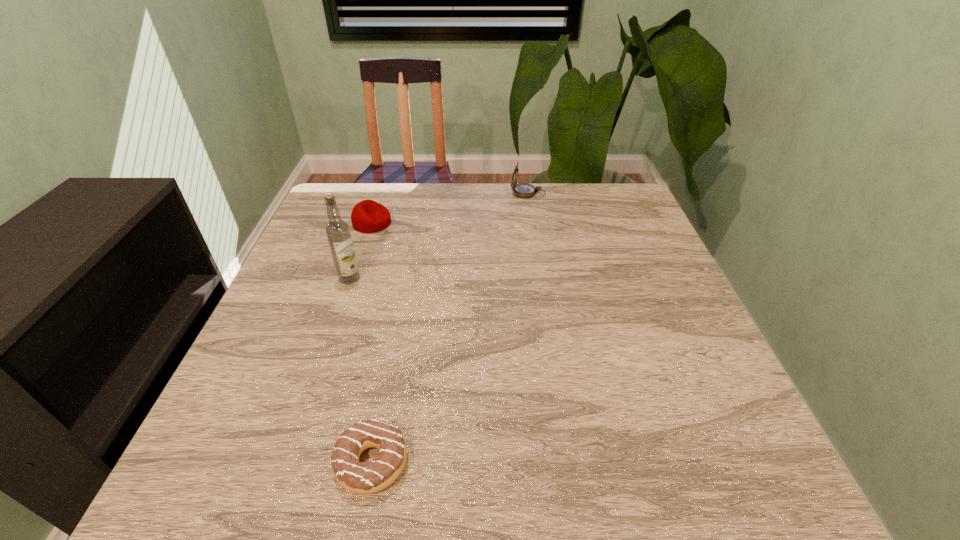
The width and height of the screenshot is (960, 540). Identify the location of unoccupied position between the vodka and the doughnut. (361, 370).

Identify the location of free space between the second object from right to left and the third farthest object. This screenshot has width=960, height=540. (361, 370).

Where is `vacant space that's between the second object from right to left and the beanbag`? Image resolution: width=960 pixels, height=540 pixels. vacant space that's between the second object from right to left and the beanbag is located at coordinates (372, 342).

The width and height of the screenshot is (960, 540). Identify the location of free space between the compass and the doughnut. (450, 328).

Where is `empty space between the third object from left to right and the second shortest object`? The image size is (960, 540). empty space between the third object from left to right and the second shortest object is located at coordinates click(372, 342).

I want to click on the third closest object to the farthest object, so click(357, 477).

Locate which object is the second closest to the vodka. Please provide its 2D coordinates. Your answer should be formatted as a tuple, i.e. [(x, y)], where the tuple contains the x and y coordinates of a point satisfying the conditions above.

[(357, 477)]

Identify the location of vacant space that satisfies the following two spatial constraints: 1. on the back side of the doughnut; 2. on the seat area of the second farthest object. Image resolution: width=960 pixels, height=540 pixels. (418, 223).

What are the coordinates of `vacant space that satisfies the following two spatial constraints: 1. on the face of the compass; 2. on the label of the third farthest object` in the screenshot? It's located at (x=542, y=279).

Find the location of a particular element. Image resolution: width=960 pixels, height=540 pixels. blank space that satisfies the following two spatial constraints: 1. on the back side of the shortest object; 2. on the seat area of the beanbag is located at coordinates (418, 223).